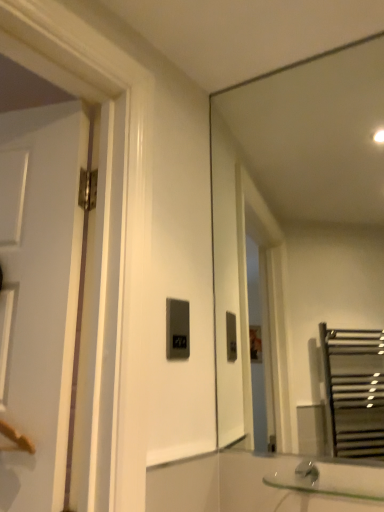
Question: Does matte black switch at center have a greater width compared to clear glass sink at lower right?

Choices:
 (A) yes
 (B) no

Answer: (B)

Question: Is matte black switch at center at the left side of clear glass sink at lower right?

Choices:
 (A) yes
 (B) no

Answer: (A)

Question: Is the depth of matte black switch at center less than that of clear glass sink at lower right?

Choices:
 (A) yes
 (B) no

Answer: (B)

Question: Can you confirm if matte black switch at center is thinner than clear glass sink at lower right?

Choices:
 (A) no
 (B) yes

Answer: (B)

Question: From a real-world perspective, is matte black switch at center physically above clear glass sink at lower right?

Choices:
 (A) no
 (B) yes

Answer: (B)

Question: Choose the correct answer: Is matte black switch at center inside clear glass sink at lower right or outside it?

Choices:
 (A) outside
 (B) inside

Answer: (A)

Question: Based on their sizes in the image, would you say matte black switch at center is bigger or smaller than clear glass sink at lower right?

Choices:
 (A) big
 (B) small

Answer: (B)

Question: Is matte black switch at center in front of or behind clear glass sink at lower right in the image?

Choices:
 (A) front
 (B) behind

Answer: (B)

Question: Is matte black switch at center taller or shorter than clear glass sink at lower right?

Choices:
 (A) short
 (B) tall

Answer: (B)

Question: Looking at their shapes, would you say matte black switch at center is wider or thinner than transparent glass mirror at upper right?

Choices:
 (A) thin
 (B) wide

Answer: (A)

Question: From the image's perspective, is matte black switch at center above or below transparent glass mirror at upper right?

Choices:
 (A) above
 (B) below

Answer: (B)

Question: Based on their positions, is matte black switch at center located to the left or right of transparent glass mirror at upper right?

Choices:
 (A) left
 (B) right

Answer: (A)

Question: From a real-world perspective, is matte black switch at center above or below transparent glass mirror at upper right?

Choices:
 (A) below
 (B) above

Answer: (A)

Question: Looking at their shapes, would you say clear glass sink at lower right is wider or thinner than transparent glass mirror at upper right?

Choices:
 (A) thin
 (B) wide

Answer: (B)

Question: In the image, is clear glass sink at lower right positioned in front of or behind transparent glass mirror at upper right?

Choices:
 (A) behind
 (B) front

Answer: (B)